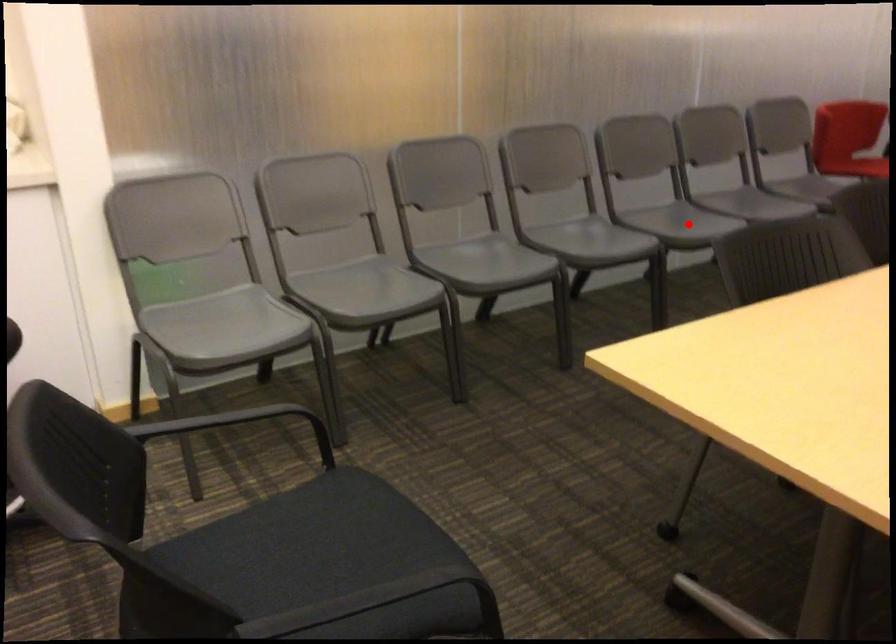
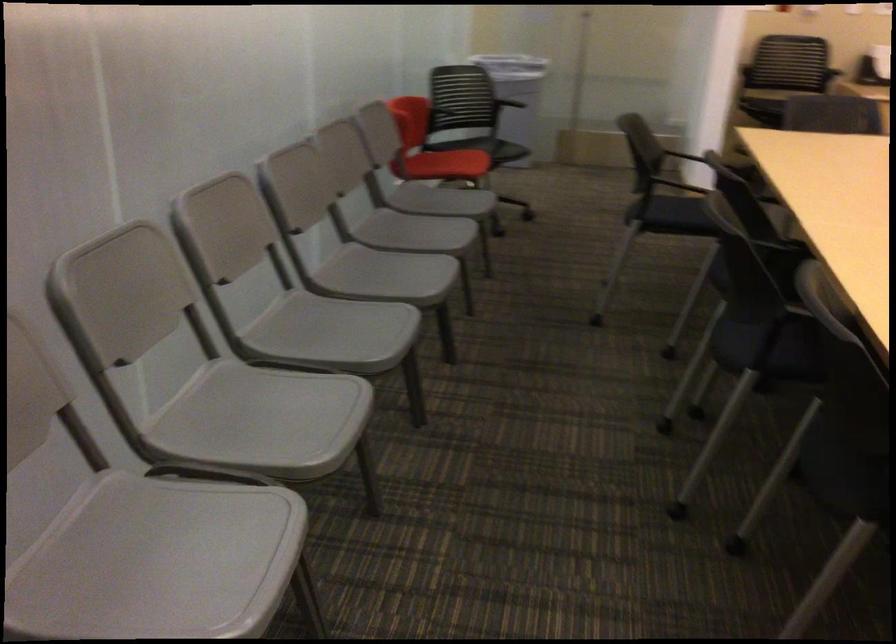
Question: I am providing you with two images of the same scene from different viewpoints. Given a red point in image1, look at the same physical point in image2. Is it:

Choices:
 (A) Closer to the viewpoint
 (B) Farther from the viewpoint

Answer: (A)